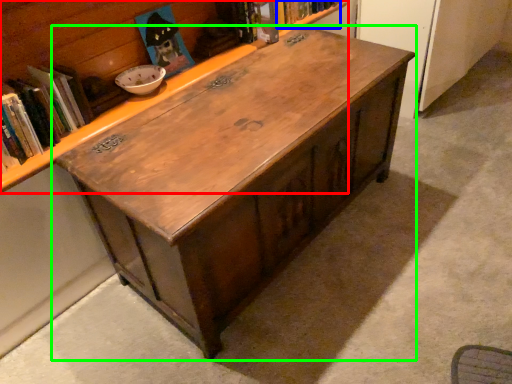
Question: Estimate the real-world distances between objects in this image. Which object is farther from bookcase (highlighted by a red box), book (highlighted by a blue box) or table (highlighted by a green box)?

Choices:
 (A) book
 (B) table

Answer: (B)